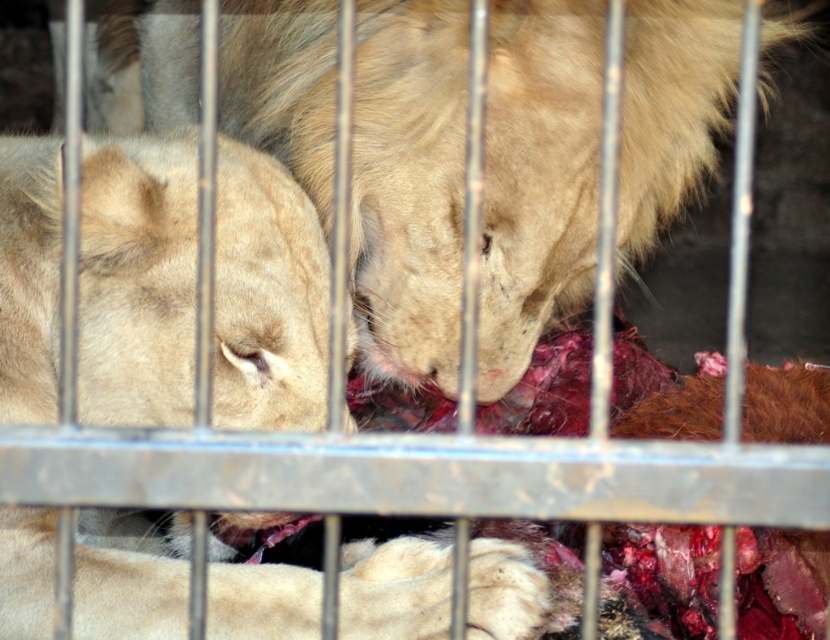
Is light brown fur at center below light beige fur at center?

No, light brown fur at center is not below light beige fur at center.

From the picture: Can you confirm if light brown fur at center is wider than light beige fur at center?

Correct, the width of light brown fur at center exceeds that of light beige fur at center.

Does point (686, 184) come farther from viewer compared to point (299, 378)?

Yes, point (686, 184) is behind point (299, 378).

Locate an element on the screen. Image resolution: width=830 pixels, height=640 pixels. light brown fur at center is located at coordinates (409, 186).